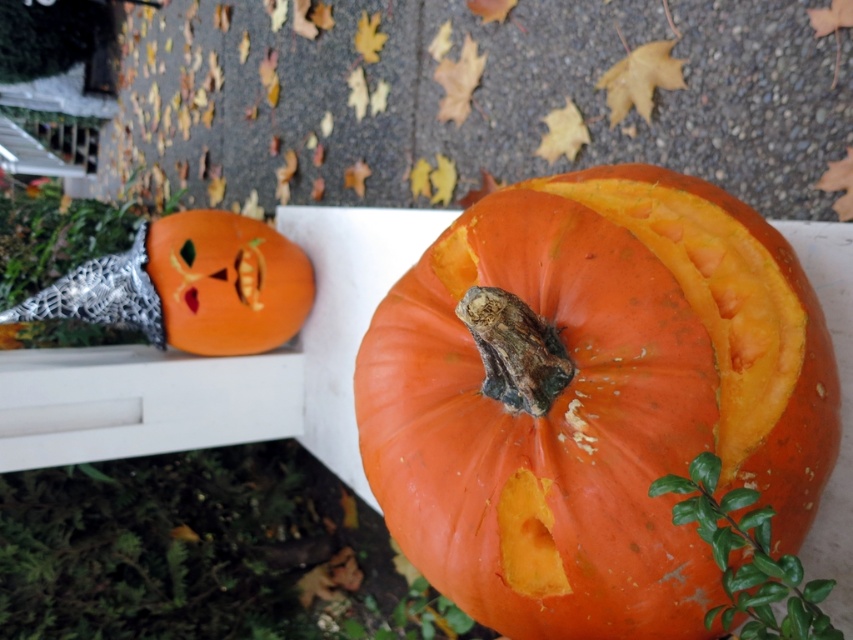
You are standing in front of the two pumpkins. The orange matte pumpkin at center is at point (x=592, y=397). Where is the carved pumpkin located relative to the orange matte pumpkin at center?

The carved pumpkin is in the background, slightly out of focus, located behind the orange matte pumpkin at center.

You are a gardener who wants to plant a new pumpkin vine between the orange matte pumpkin at center and the orange matte pumpkin at upper left. Which pumpkin should you place the vine closer to if you want the vine to grow upwards towards the sunlight coming from above?

The orange matte pumpkin at upper left is above the orange matte pumpkin at center, so the gardener should place the vine closer to the orange matte pumpkin at upper left to allow the vine to grow upwards toward the sunlight.

You are standing in front of a pumpkin display and need to locate the orange matte pumpkin at center. According to the coordinates, where exactly is it positioned?

The orange matte pumpkin at center is located at the 2D coordinates point (x=592, y=397).